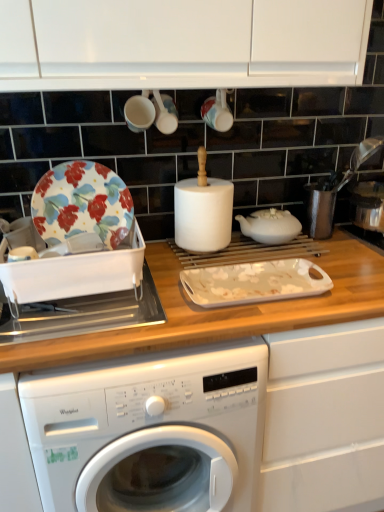
Where is `matte ceramic cup at upper center, which is counted as the 1th tableware, starting from the right`? The image size is (384, 512). matte ceramic cup at upper center, which is counted as the 1th tableware, starting from the right is located at coordinates (218, 111).

Describe the element at coordinates (163, 111) in the screenshot. This screenshot has width=384, height=512. I see `white glossy cup at upper center, the 2th tableware in the right-to-left sequence` at that location.

This screenshot has height=512, width=384. What are the coordinates of `white glossy cup at upper center, the 2th tableware in the right-to-left sequence` in the screenshot? It's located at (163, 111).

Where is `matte white cup at upper center, the first tableware when ordered from left to right`? matte white cup at upper center, the first tableware when ordered from left to right is located at coordinates pyautogui.click(x=139, y=113).

The width and height of the screenshot is (384, 512). What do you see at coordinates (83, 314) in the screenshot?
I see `white plastic dish rack at left` at bounding box center [83, 314].

This screenshot has width=384, height=512. I want to click on white plastic dish rack at left, so click(x=83, y=314).

Measure the distance between floral-patterned ceramic plate at left and camera.

The depth of floral-patterned ceramic plate at left is 3.74 feet.

What is the approximate width of floral-patterned ceramic plate at left?

floral-patterned ceramic plate at left is 1.61 inches in width.

Where is `wooden at center`? wooden at center is located at coordinates (221, 311).

Identify the location of white glossy baking sheet at center. The height and width of the screenshot is (512, 384). (254, 282).

How much distance is there between white glossy baking sheet at center and matte ceramic cup at upper center, positioned as the 3th tableware in left-to-right order?

white glossy baking sheet at center and matte ceramic cup at upper center, positioned as the 3th tableware in left-to-right order, are 50.29 centimeters apart from each other.

Is white glossy baking sheet at center oriented towards matte ceramic cup at upper center, which is counted as the 1th tableware, starting from the right?

No, white glossy baking sheet at center is not oriented towards matte ceramic cup at upper center, which is counted as the 1th tableware, starting from the right.

Which is farther, (273, 262) or (211, 96)?

The point (211, 96) is farther.

From a real-world perspective, which tableware is the 1st one above the white glossy baking sheet at center? Please provide its 2D coordinates.

[(218, 111)]

Is matte ceramic cup at upper center, which is counted as the 1th tableware, starting from the right, oriented away from white glossy baking sheet at center?

No, matte ceramic cup at upper center, which is counted as the 1th tableware, starting from the right,'s orientation is not away from white glossy baking sheet at center.

Is matte ceramic cup at upper center, positioned as the 3th tableware in left-to-right order, positioned behind white glossy baking sheet at center?

Yes, it is.

Between matte ceramic cup at upper center, which is counted as the 1th tableware, starting from the right, and white glossy baking sheet at center, which one has smaller size?

Smaller between the two is matte ceramic cup at upper center, which is counted as the 1th tableware, starting from the right.

Who is more distant, white glossy baking sheet at center or matte white cup at upper center, the first tableware when ordered from left to right?

Positioned behind is matte white cup at upper center, the first tableware when ordered from left to right.

How different are the orientations of white glossy baking sheet at center and matte white cup at upper center, the first tableware when ordered from left to right, in degrees?

They differ by 1.98 degrees in their facing directions.

From a real-world perspective, is white glossy baking sheet at center physically located above or below matte white cup at upper center, the first tableware when ordered from left to right?

white glossy baking sheet at center is below matte white cup at upper center, the first tableware when ordered from left to right.

Is point (291, 271) positioned behind point (139, 102)?

No, it is not.

Considering the relative sizes of white glossy cup at upper center, the 2th tableware in the right-to-left sequence, and wooden at center in the image provided, is white glossy cup at upper center, the 2th tableware in the right-to-left sequence, wider than wooden at center?

No, white glossy cup at upper center, the 2th tableware in the right-to-left sequence, is not wider than wooden at center.

From a real-world perspective, is white glossy cup at upper center, the 2th tableware in the right-to-left sequence, positioned over wooden at center based on gravity?

Yes.

Which point is more distant from viewer, (173, 120) or (236, 323)?

The point (173, 120) is more distant.

Based on the photo, is white glossy cup at upper center, the 2th tableware in the right-to-left sequence, taller or shorter than wooden at center?

In the image, white glossy cup at upper center, the 2th tableware in the right-to-left sequence, appears to be shorter than wooden at center.

From a real-world perspective, is white glossy baking sheet at center under floral-patterned ceramic plate at left?

Yes, from a real-world perspective, white glossy baking sheet at center is below floral-patterned ceramic plate at left.

Based on the photo, from the image's perspective, is white glossy baking sheet at center positioned above or below floral-patterned ceramic plate at left?

Based on their image positions, white glossy baking sheet at center is located beneath floral-patterned ceramic plate at left.

Is floral-patterned ceramic plate at left a part of white glossy baking sheet at center?

That's incorrect, floral-patterned ceramic plate at left is not inside white glossy baking sheet at center.

Is white glossy cup at upper center, the 2th tableware in the right-to-left sequence, facing towards white plastic dish rack at left?

No, white glossy cup at upper center, the 2th tableware in the right-to-left sequence, is not aimed at white plastic dish rack at left.

Considering the relative sizes of white glossy cup at upper center, the 2th tableware in the right-to-left sequence, and white plastic dish rack at left in the image provided, is white glossy cup at upper center, the 2th tableware in the right-to-left sequence, shorter than white plastic dish rack at left?

Yes, white glossy cup at upper center, the 2th tableware in the right-to-left sequence, is shorter than white plastic dish rack at left.

Based on the photo, which object is further away from the camera taking this photo, white glossy cup at upper center, positioned as the 2th tableware in left-to-right order, or white plastic dish rack at left?

white glossy cup at upper center, positioned as the 2th tableware in left-to-right order, is behind.

Choose the correct answer: Is floral-patterned ceramic plate at left inside matte ceramic cup at upper center, which is counted as the 1th tableware, starting from the right, or outside it?

floral-patterned ceramic plate at left cannot be found inside matte ceramic cup at upper center, which is counted as the 1th tableware, starting from the right.

Considering the positions of objects floral-patterned ceramic plate at left and matte ceramic cup at upper center, positioned as the 3th tableware in left-to-right order, in the image provided, who is in front, floral-patterned ceramic plate at left or matte ceramic cup at upper center, positioned as the 3th tableware in left-to-right order,?

floral-patterned ceramic plate at left.

Does floral-patterned ceramic plate at left have a greater width compared to matte ceramic cup at upper center, which is counted as the 1th tableware, starting from the right?

In fact, floral-patterned ceramic plate at left might be narrower than matte ceramic cup at upper center, which is counted as the 1th tableware, starting from the right.

From the image's perspective, does floral-patterned ceramic plate at left appear lower than matte ceramic cup at upper center, positioned as the 3th tableware in left-to-right order?

Indeed, from the image's perspective, floral-patterned ceramic plate at left is shown beneath matte ceramic cup at upper center, positioned as the 3th tableware in left-to-right order.

Locate an element on the screen. tableware that is the 1st one above the white glossy baking sheet at center (from a real-world perspective) is located at coordinates click(218, 111).

Identify the location of the 3rd tableware behind when counting from the white glossy baking sheet at center. This screenshot has width=384, height=512. (218, 111).

Consider the image. Based on their spatial positions, is matte white cup at upper center, which is the 3th tableware in right-to-left order, or wooden at center closer to white glossy cup at upper center, the 2th tableware in the right-to-left sequence?

matte white cup at upper center, which is the 3th tableware in right-to-left order, is positioned closer to the anchor white glossy cup at upper center, the 2th tableware in the right-to-left sequence.

Looking at the image, which one is located closer to wooden at center, white glossy baking sheet at center or white plastic dish rack at left?

The object closer to wooden at center is white glossy baking sheet at center.

In the scene shown: Estimate the real-world distances between objects in this image. Which object is further from wooden at center, floral-patterned ceramic plate at left or matte white cup at upper center, the first tableware when ordered from left to right?

matte white cup at upper center, the first tableware when ordered from left to right, lies further to wooden at center than the other object.

Estimate the real-world distances between objects in this image. Which object is further from wooden at center, matte white cup at upper center, the first tableware when ordered from left to right, or matte ceramic cup at upper center, which is counted as the 1th tableware, starting from the right?

matte white cup at upper center, the first tableware when ordered from left to right, is further to wooden at center.

Estimate the real-world distances between objects in this image. Which object is further from white plastic dish rack at left, white glossy baking sheet at center or matte white cup at upper center, which is the 3th tableware in right-to-left order?

Based on the image, matte white cup at upper center, which is the 3th tableware in right-to-left order, appears to be further to white plastic dish rack at left.

Which object lies further to the anchor point floral-patterned ceramic plate at left, white glossy cup at upper center, the 2th tableware in the right-to-left sequence, or white glossy baking sheet at center?

white glossy baking sheet at center.

Estimate the real-world distances between objects in this image. Which object is closer to white plastic dish rack at left, white glossy cup at upper center, the 2th tableware in the right-to-left sequence, or floral-patterned ceramic plate at left?

floral-patterned ceramic plate at left lies closer to white plastic dish rack at left than the other object.

From the image, which object appears to be nearer to white glossy cup at upper center, positioned as the 2th tableware in left-to-right order, matte white cup at upper center, which is the 3th tableware in right-to-left order, or matte ceramic cup at upper center, positioned as the 3th tableware in left-to-right order?

matte white cup at upper center, which is the 3th tableware in right-to-left order, is positioned closer to the anchor white glossy cup at upper center, positioned as the 2th tableware in left-to-right order.

Locate an element on the screen. baking sheet between matte white cup at upper center, which is the 3th tableware in right-to-left order, and wooden at center vertically is located at coordinates (254, 282).

Locate an element on the screen. The width and height of the screenshot is (384, 512). baking sheet between white glossy cup at upper center, the 2th tableware in the right-to-left sequence, and wooden at center in the up-down direction is located at coordinates (254, 282).

Image resolution: width=384 pixels, height=512 pixels. I want to click on plate between matte ceramic cup at upper center, positioned as the 3th tableware in left-to-right order, and wooden at center vertically, so click(x=82, y=204).

You are a GUI agent. You are given a task and a screenshot of the screen. Output one action in this format:
    pyautogui.click(x=<x>, y=<y>)
    Task: Click on the plate that lies between white glossy cup at upper center, positioned as the 2th tableware in left-to-right order, and white plastic dish rack at left from top to bottom
    The width and height of the screenshot is (384, 512).
    Given the screenshot: What is the action you would take?
    pyautogui.click(x=82, y=204)